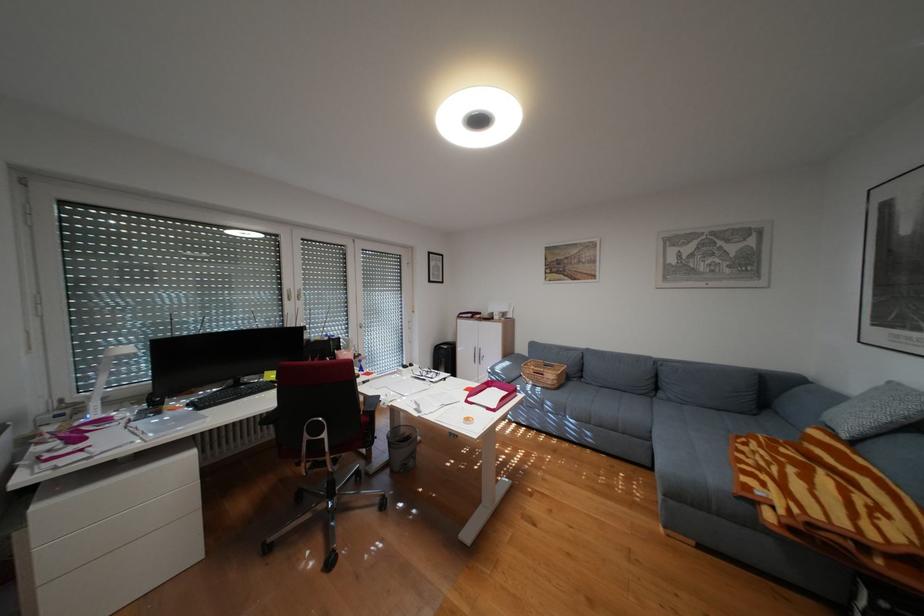
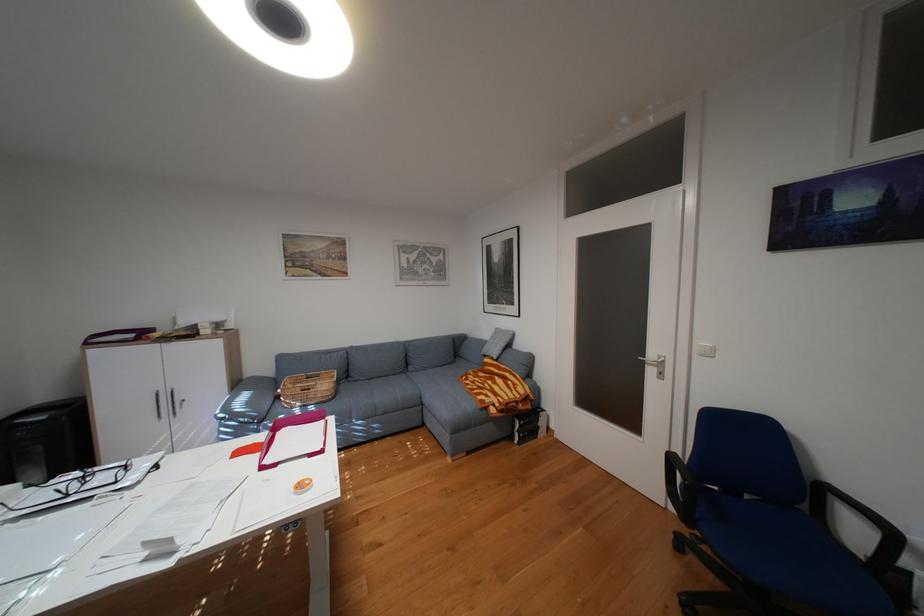
Where in the second image is the point corresponding to point 481,398 from the first image?

(280, 460)